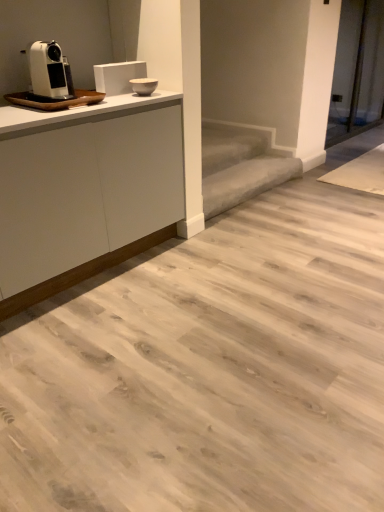
Question: Is the position of gray carpeted stair at center less distant than that of white matte cabinet at upper left?

Choices:
 (A) no
 (B) yes

Answer: (A)

Question: Does gray carpeted stair at center have a larger size compared to white matte cabinet at upper left?

Choices:
 (A) no
 (B) yes

Answer: (A)

Question: From a real-world perspective, is gray carpeted stair at center positioned under white matte cabinet at upper left based on gravity?

Choices:
 (A) yes
 (B) no

Answer: (A)

Question: Is gray carpeted stair at center taller than white matte cabinet at upper left?

Choices:
 (A) no
 (B) yes

Answer: (A)

Question: Does gray carpeted stair at center contain white matte cabinet at upper left?

Choices:
 (A) no
 (B) yes

Answer: (A)

Question: Considering their positions, is white matte cabinet at upper left located in front of or behind gray carpeted stair at center?

Choices:
 (A) behind
 (B) front

Answer: (B)

Question: Do you think white matte cabinet at upper left is within gray carpeted stair at center, or outside of it?

Choices:
 (A) inside
 (B) outside

Answer: (B)

Question: From the image's perspective, is white matte cabinet at upper left located above or below gray carpeted stair at center?

Choices:
 (A) above
 (B) below

Answer: (B)

Question: From a real-world perspective, is white matte cabinet at upper left above or below gray carpeted stair at center?

Choices:
 (A) above
 (B) below

Answer: (A)

Question: From the image's perspective, is white plastic coffee machine at left above or below gray carpeted stair at center?

Choices:
 (A) below
 (B) above

Answer: (B)

Question: Is white plastic coffee machine at left wider or thinner than gray carpeted stair at center?

Choices:
 (A) wide
 (B) thin

Answer: (B)

Question: Would you say white plastic coffee machine at left is to the left or to the right of gray carpeted stair at center in the picture?

Choices:
 (A) right
 (B) left

Answer: (B)

Question: Based on their sizes in the image, would you say white plastic coffee machine at left is bigger or smaller than gray carpeted stair at center?

Choices:
 (A) big
 (B) small

Answer: (B)

Question: From a real-world perspective, is gray carpeted stair at center positioned above or below white plastic coffee machine at left?

Choices:
 (A) above
 (B) below

Answer: (B)

Question: In terms of height, does gray carpeted stair at center look taller or shorter compared to white plastic coffee machine at left?

Choices:
 (A) tall
 (B) short

Answer: (B)